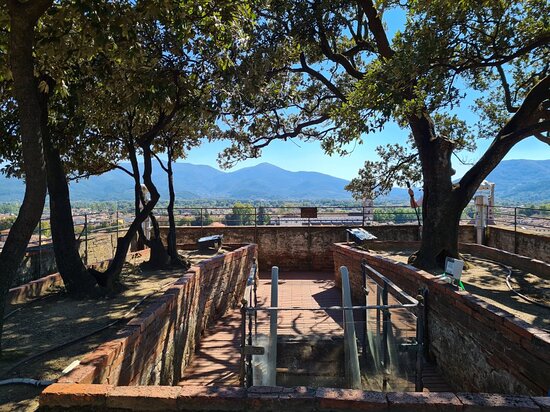
Where is `cord`? This screenshot has width=550, height=412. cord is located at coordinates (521, 294), (91, 333).